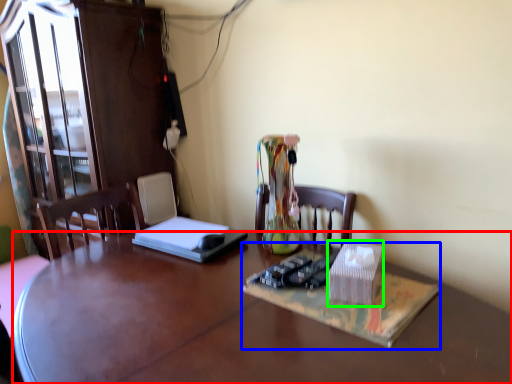
Question: Which object is positioned closest to desk (highlighted by a red box)? Select from book (highlighted by a blue box) and cardboard box (highlighted by a green box).

Choices:
 (A) book
 (B) cardboard box

Answer: (A)